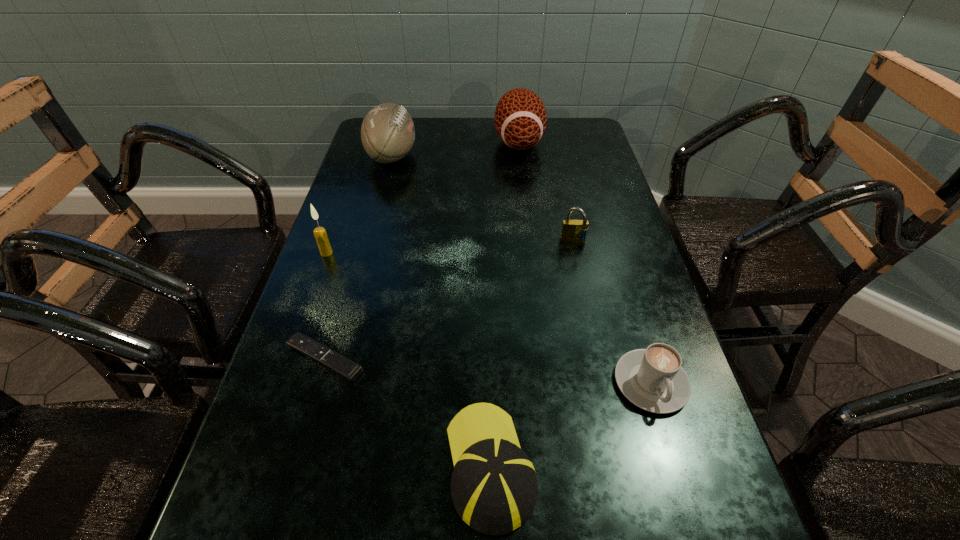
Find the location of a particular element. The height and width of the screenshot is (540, 960). padlock at the right edge is located at coordinates (572, 230).

Locate an element on the screen. Image resolution: width=960 pixels, height=540 pixels. cappuccino present at the right edge is located at coordinates (652, 379).

This screenshot has height=540, width=960. What are the coordinates of `object present at the far left corner` in the screenshot? It's located at (387, 132).

Image resolution: width=960 pixels, height=540 pixels. I want to click on vacant space at the left edge, so click(391, 205).

Locate an element on the screen. The width and height of the screenshot is (960, 540). vacant space at the right edge of the desktop is located at coordinates (612, 341).

The image size is (960, 540). What are the coordinates of `free location at the far right corner` in the screenshot? It's located at (552, 144).

Identify the location of free spot between the left football (American) and the cappuccino. (521, 269).

This screenshot has width=960, height=540. I want to click on unoccupied area between the baseball cap and the right football (American), so click(505, 304).

Find the location of a particular element. This screenshot has width=960, height=540. empty space that is in between the right football (American) and the left football (American) is located at coordinates 455,149.

Where is `unoccupied position between the baseball cap and the padlock`? The image size is (960, 540). unoccupied position between the baseball cap and the padlock is located at coordinates (532, 354).